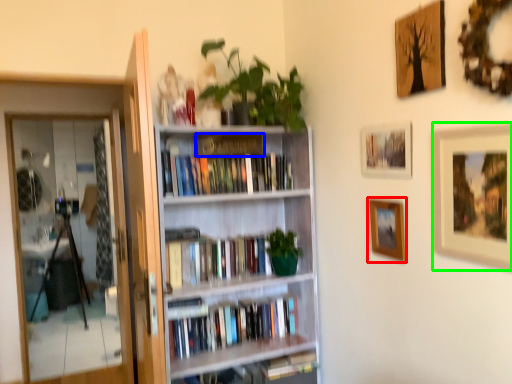
Question: Which object is the farthest from picture frame (highlighted by a red box)? Choose among these: paperback book (highlighted by a blue box) or picture frame (highlighted by a green box).

Choices:
 (A) paperback book
 (B) picture frame

Answer: (A)